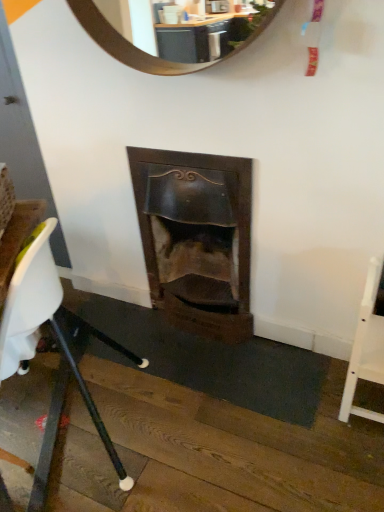
Question: Do you think wooden fireplace at center is within white plastic chair at lower left, acting as the first chair starting from the left, or outside of it?

Choices:
 (A) outside
 (B) inside

Answer: (A)

Question: Is wooden fireplace at center bigger or smaller than white plastic chair at lower left, which is the second chair in right-to-left order?

Choices:
 (A) big
 (B) small

Answer: (B)

Question: Which of these objects is positioned closest to the white wood chair at right, placed as the 2th chair when sorted from left to right?

Choices:
 (A) wooden fireplace at center
 (B) white plastic chair at lower left, which is the second chair in right-to-left order

Answer: (A)

Question: Based on their relative distances, which object is nearer to the wooden fireplace at center?

Choices:
 (A) white plastic chair at lower left, which is the second chair in right-to-left order
 (B) white wood chair at right, the first chair viewed from the right

Answer: (A)